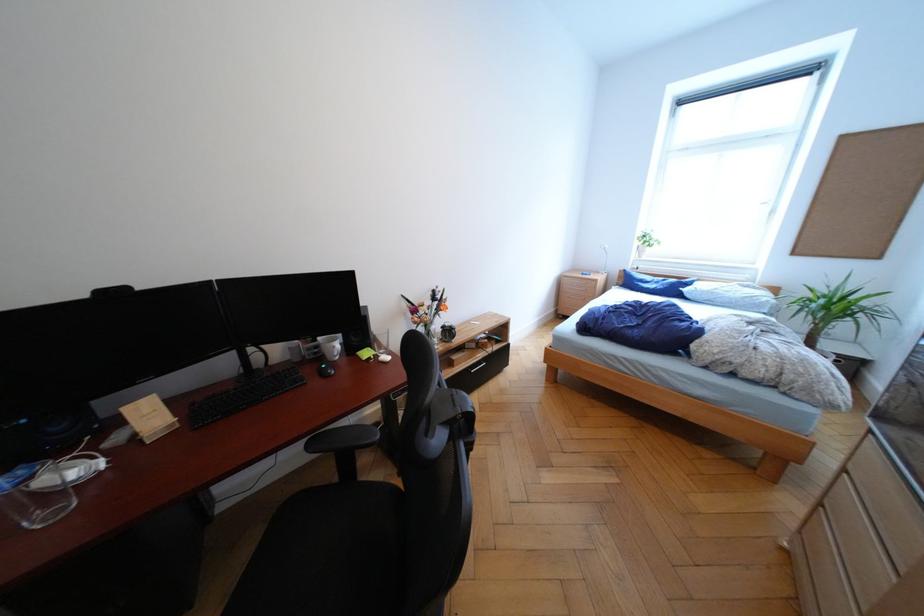
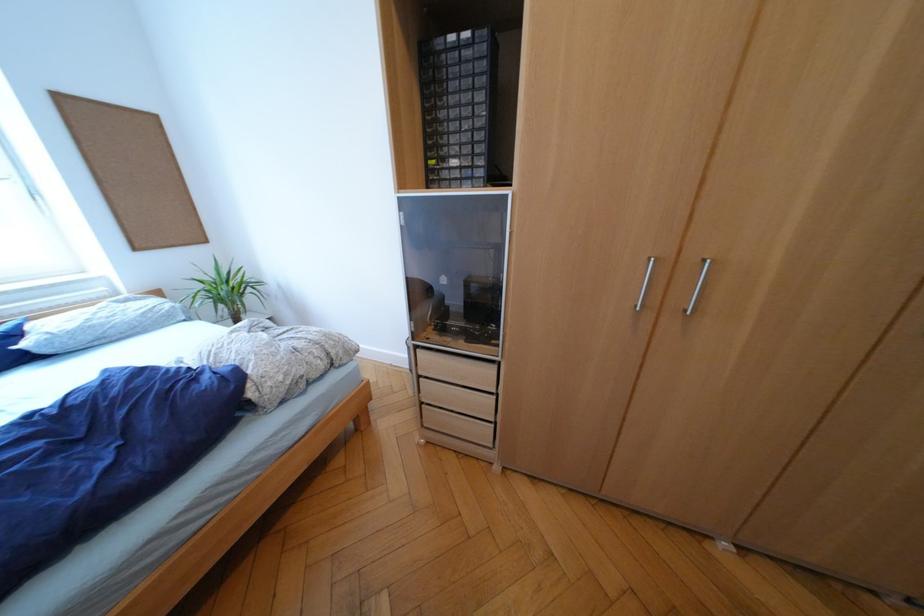
The images are taken continuously from a first-person perspective. In which direction is your viewpoint rotating?

The camera rotated toward right-down.